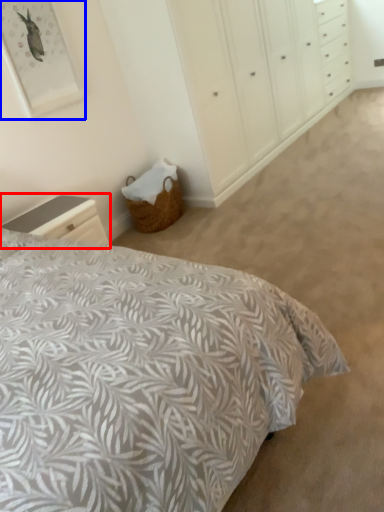
Question: Which point is closer to the camera, nightstand (highlighted by a red box) or picture frame (highlighted by a blue box)?

Choices:
 (A) nightstand
 (B) picture frame

Answer: (A)